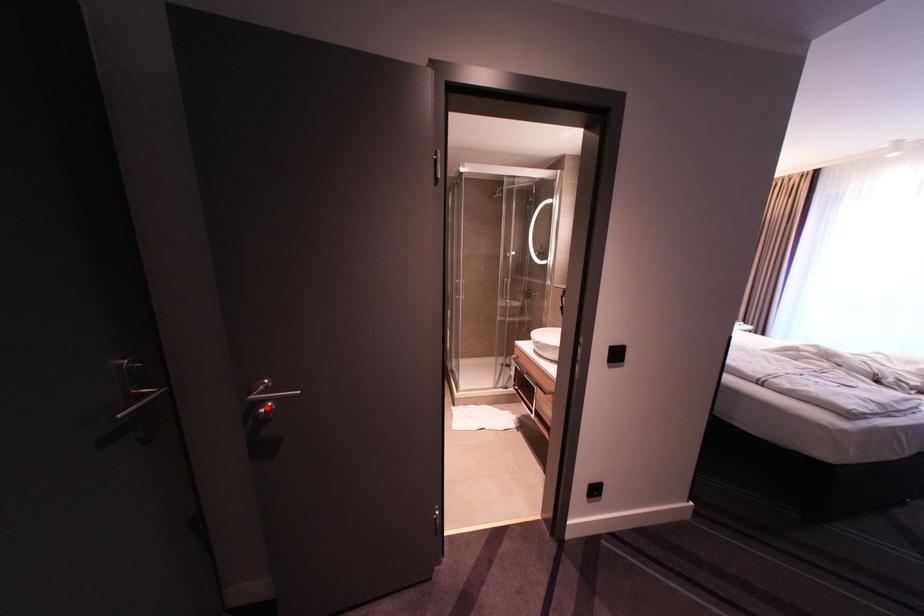
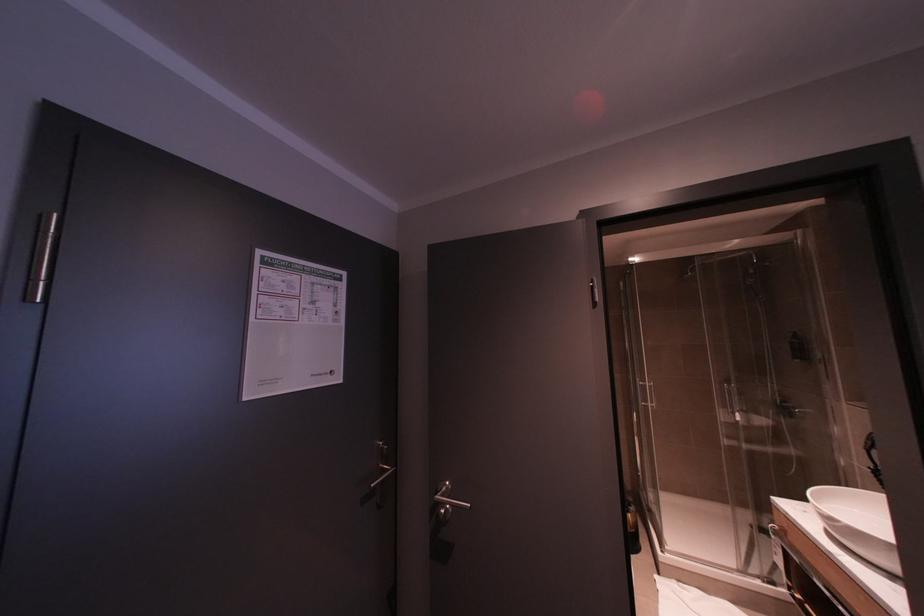
Locate, in the second image, the point that corresponds to the highlighted location in the first image.

(446, 509)